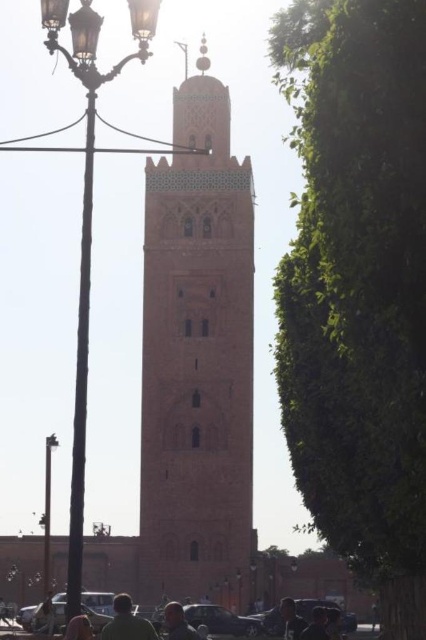
Does point (157, 541) come farther from viewer compared to point (75, 627)?

No, (157, 541) is closer to viewer.

Which is in front, point (212, 298) or point (66, 628)?

Point (212, 298) is more forward.

Describe the element at coordinates (196, 356) in the screenshot. The height and width of the screenshot is (640, 426). I see `brick textured bell tower at center` at that location.

Identify the location of brick textured bell tower at center. (196, 356).

Who is shorter, brick textured bell tower at center or metallic streetlamp at left?

metallic streetlamp at left is shorter.

Is point (172, 330) positioned before point (48, 593)?

Yes, point (172, 330) is in front of point (48, 593).

Which is behind, point (184, 376) or point (49, 508)?

Point (49, 508)

At what (x,y) coordinates should I click in order to perform the action: click on brick textured bell tower at center. Please return your answer as a coordinate pair (x, y). The image size is (426, 640). Looking at the image, I should click on (196, 356).

Does brass wrought iron streetlight at left have a lesser width compared to polished brass lamp post at center?

No.

Who is taller, brass wrought iron streetlight at left or polished brass lamp post at center?

With more height is brass wrought iron streetlight at left.

Is point (57, 45) less distant than point (255, 593)?

Yes, point (57, 45) is closer to viewer.

At what (x,y) coordinates should I click in order to perform the action: click on brass wrought iron streetlight at left. Please return your answer as a coordinate pair (x, y). Looking at the image, I should click on (88, 221).